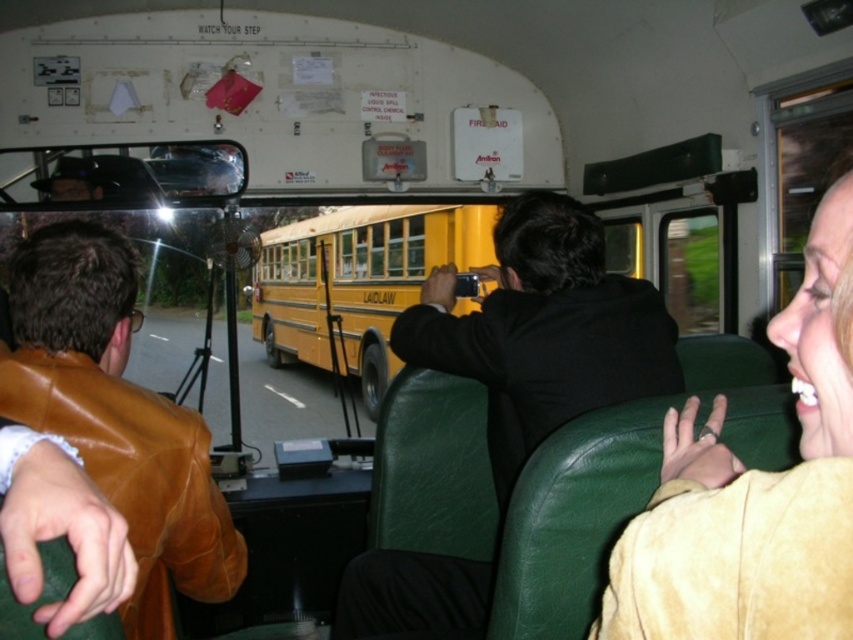
Measure the distance from black matte jacket at center to brown leather jacket at upper left.

They are 65.34 centimeters apart.

Between point (469, 346) and point (32, 248), which one is positioned in front?

Point (32, 248)

Is point (543, 195) closer to camera compared to point (125, 492)?

That is False.

This screenshot has width=853, height=640. Identify the location of black matte jacket at center. pyautogui.click(x=543, y=330).

Who is shorter, light beige suede jacket at right or brown leather jacket at upper left?

light beige suede jacket at right

Between light beige suede jacket at right and brown leather jacket at upper left, which one appears on the left side from the viewer's perspective?

brown leather jacket at upper left

Does point (819, 356) lie behind point (119, 394)?

No, it is not.

I want to click on light beige suede jacket at right, so click(755, 490).

Which is behind, point (840, 413) or point (521, 404)?

Point (521, 404)

Can you confirm if light beige suede jacket at right is taller than black matte jacket at center?

No.

Does point (798, 419) come farther from viewer compared to point (599, 282)?

No.

Identify the location of light beige suede jacket at right. (755, 490).